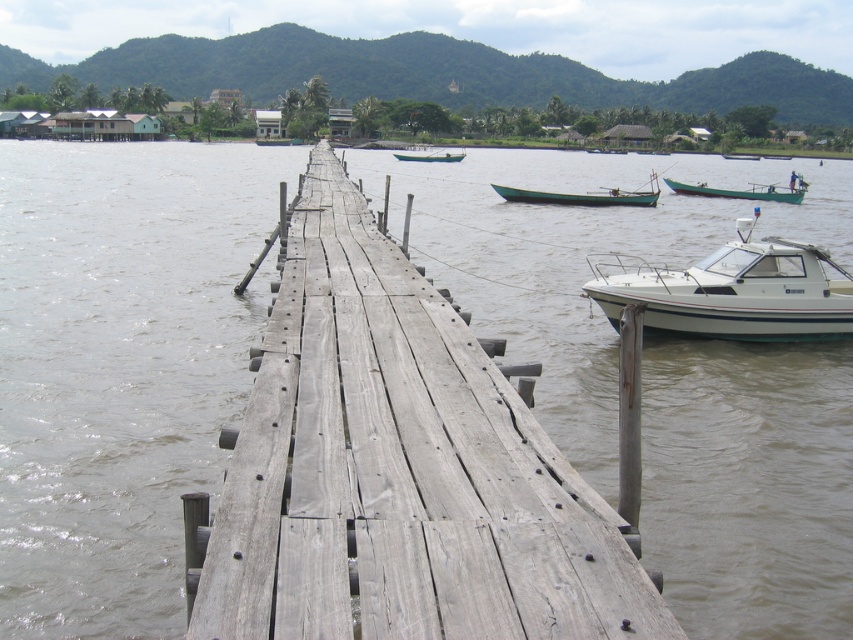
Question: Can you confirm if white glossy boat at right is wider than green matte boat at right?

Choices:
 (A) no
 (B) yes

Answer: (B)

Question: Which point appears farthest from the camera in this image?

Choices:
 (A) (408, 154)
 (B) (780, 292)
 (C) (688, 184)

Answer: (A)

Question: Is white glossy boat at right to the right of green matte boat at center from the viewer's perspective?

Choices:
 (A) no
 (B) yes

Answer: (B)

Question: Which point is closer to the camera?

Choices:
 (A) weathered wood bridge at center
 (B) green matte boat at center
 (C) green wooden boat at center
 (D) green matte boat at right

Answer: (A)

Question: Which object is closer to the camera taking this photo?

Choices:
 (A) green matte boat at center
 (B) green wooden boat at center
 (C) white glossy boat at right

Answer: (C)

Question: Can you confirm if white glossy boat at right is wider than green matte boat at right?

Choices:
 (A) no
 (B) yes

Answer: (B)